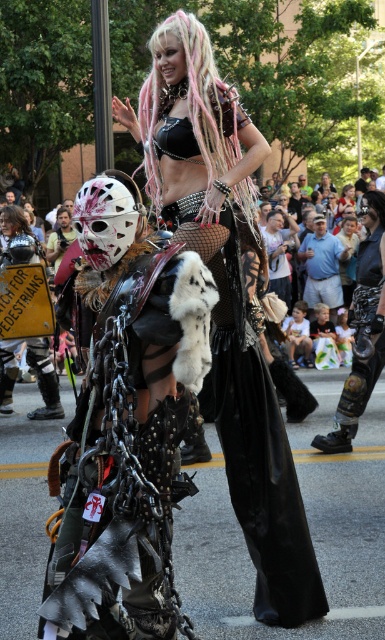
Question: Is black leather skirt at center wider than metallic chainmail helmet at left?

Choices:
 (A) no
 (B) yes

Answer: (B)

Question: Is metallic chain armor at center positioned before black leather skirt at center?

Choices:
 (A) no
 (B) yes

Answer: (B)

Question: Which point is farther from the camera taking this photo?

Choices:
 (A) (192, 68)
 (B) (6, 380)
 (C) (323, 234)
 (D) (120, 371)

Answer: (C)

Question: Which object appears closest to the camera in this image?

Choices:
 (A) metallic chainmail helmet at left
 (B) matte black helmet at left
 (C) black leather skirt at center
 (D) pink dreadlocks at center

Answer: (B)

Question: Can you confirm if matte black helmet at left is wider than metallic chainmail helmet at left?

Choices:
 (A) no
 (B) yes

Answer: (B)

Question: Among these points, which one is farthest from the camera?

Choices:
 (A) (264, 342)
 (B) (6, 342)
 (C) (152, 122)

Answer: (B)